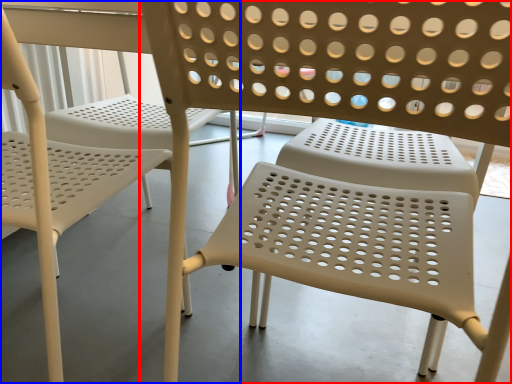
Question: Which object appears closest to the camera in this image, chair (highlighted by a red box) or chair (highlighted by a blue box)?

Choices:
 (A) chair
 (B) chair

Answer: (A)